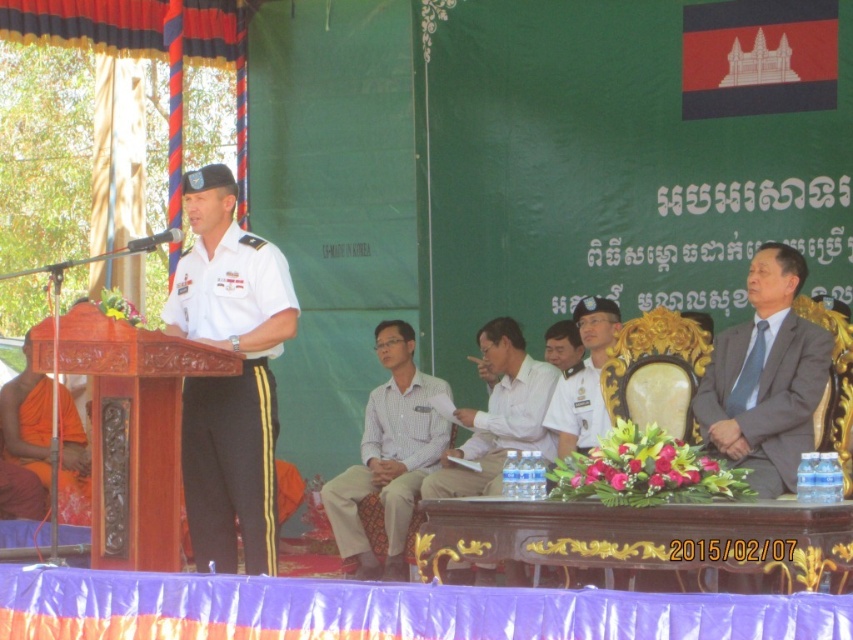
Which is in front, point (64, 492) or point (595, 412)?

Point (595, 412) is in front.

Consider the image. Does orange cloth at left have a lesser width compared to white matte uniform at center?

No.

Where is `orange cloth at left`? This screenshot has height=640, width=853. orange cloth at left is located at coordinates (27, 422).

At what (x,y) coordinates should I click in order to perform the action: click on white cotton shirt at center. Please return your answer as a coordinate pair (x, y). Looking at the image, I should click on (390, 460).

At what (x,y) coordinates should I click in order to perform the action: click on white cotton shirt at center. Please return your answer as a coordinate pair (x, y). The height and width of the screenshot is (640, 853). Looking at the image, I should click on coord(390,460).

Find the location of a particular element. The image size is (853, 640). white uniform at center is located at coordinates (231, 465).

Which of these two, white uniform at center or white cotton shirt at center, stands shorter?

white cotton shirt at center is shorter.

Locate an element on the screen. The image size is (853, 640). white uniform at center is located at coordinates (231, 465).